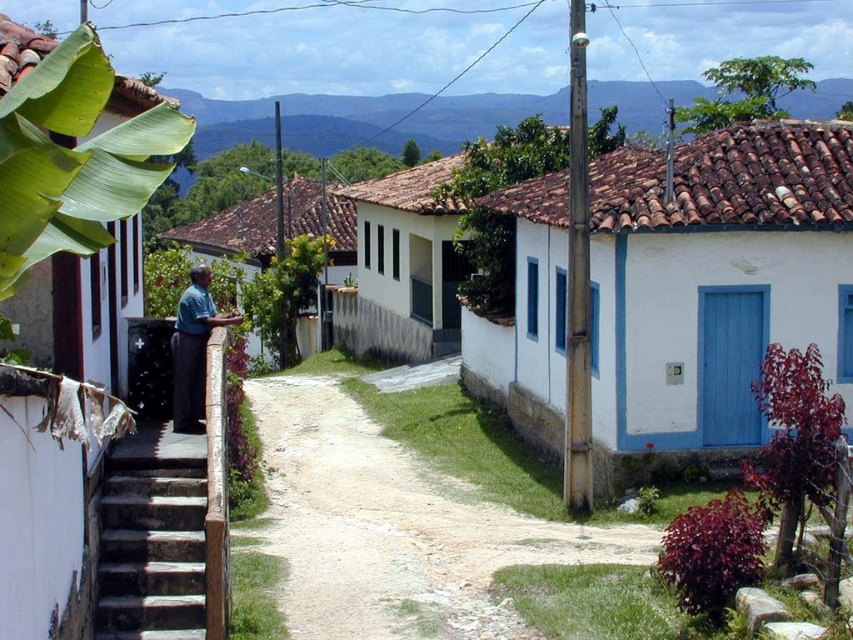
You are standing at the point labeled as point (152, 538) in the image. What is the surface you are currently standing on?

The surface you are standing on is dark gray concrete stairs at lower left.